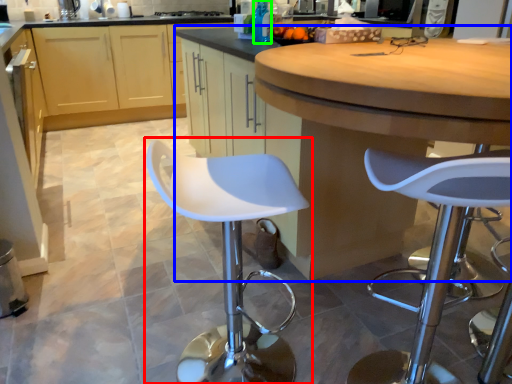
Question: Estimate the real-world distances between objects in this image. Which object is farther from chair (highlighted by a red box), cabinetry (highlighted by a blue box) or bottle (highlighted by a green box)?

Choices:
 (A) cabinetry
 (B) bottle

Answer: (B)